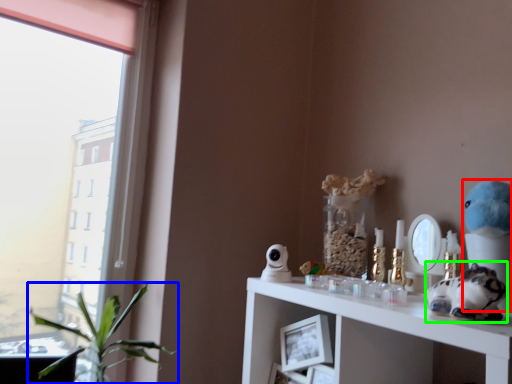
Question: Which object is the farthest from figurine (highlighted by a red box)? Choose among these: houseplant (highlighted by a blue box) or toy (highlighted by a green box).

Choices:
 (A) houseplant
 (B) toy

Answer: (A)